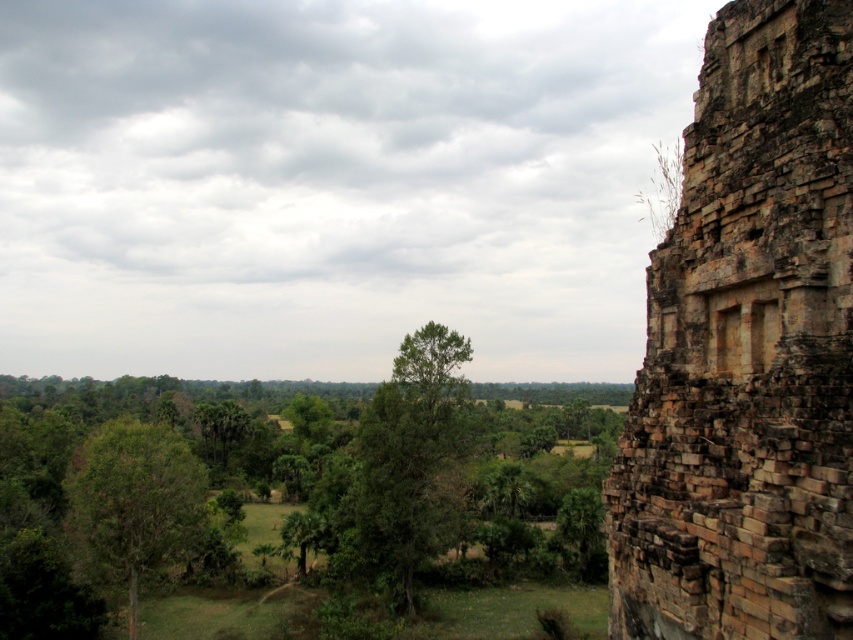
Looking at this image, who is more forward, (747, 240) or (200, 524)?

Point (747, 240)

Can you confirm if brown stone wall at right is positioned below green leafy tree at left?

Actually, brown stone wall at right is above green leafy tree at left.

Is point (735, 22) positioned before point (109, 442)?

That is True.

Find the location of a particular element. The width and height of the screenshot is (853, 640). brown stone wall at right is located at coordinates coord(747,352).

From the picture: Can you confirm if brown stone wall at right is bigger than green leafy tree at center?

No.

Which is more to the right, brown stone wall at right or green leafy tree at center?

brown stone wall at right is more to the right.

Where is `brown stone wall at right`? brown stone wall at right is located at coordinates (747, 352).

Image resolution: width=853 pixels, height=640 pixels. Identify the location of green leafy tree at center. (409, 465).

Is green leafy tree at center above green leafy tree at left?

Correct, green leafy tree at center is located above green leafy tree at left.

Who is more distant from viewer, [363,428] or [160,518]?

Positioned behind is point [363,428].

The image size is (853, 640). I want to click on green leafy tree at center, so click(409, 465).